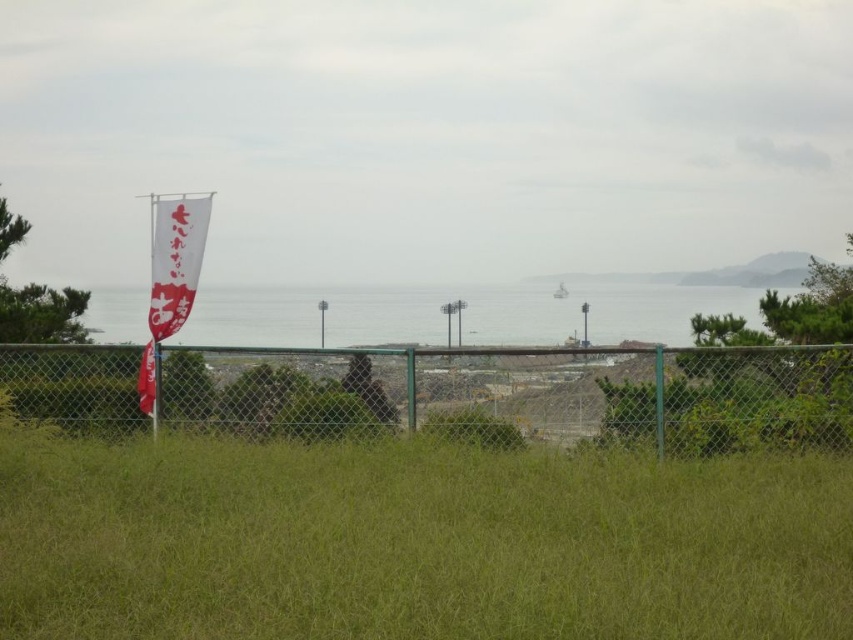
Can you confirm if white paper flag at left is positioned above metallic chain-link fence at center?

Indeed, white paper flag at left is positioned over metallic chain-link fence at center.

Does white paper flag at left have a greater width compared to metallic chain-link fence at center?

Indeed, white paper flag at left has a greater width compared to metallic chain-link fence at center.

You are a GUI agent. You are given a task and a screenshot of the screen. Output one action in this format:
    pyautogui.click(x=<x>, y=<y>)
    Task: Click on the white paper flag at left
    
    Given the screenshot: What is the action you would take?
    pyautogui.click(x=170, y=276)

Image resolution: width=853 pixels, height=640 pixels. Identify the location of white paper flag at left. (170, 276).

Between green grass at center and white paper flag at left, which one has less height?

green grass at center

Does green grass at center have a smaller size compared to white paper flag at left?

Yes, green grass at center is smaller than white paper flag at left.

The image size is (853, 640). Describe the element at coordinates (415, 541) in the screenshot. I see `green grass at center` at that location.

Identify the location of green grass at center. This screenshot has width=853, height=640. (415, 541).

Measure the distance between point (x=415, y=612) and camera.

Point (x=415, y=612) and camera are 4.96 meters apart.

Between green grass at center and green chain-link fence at center, which one is positioned higher?

green chain-link fence at center

Identify the location of green grass at center. (415, 541).